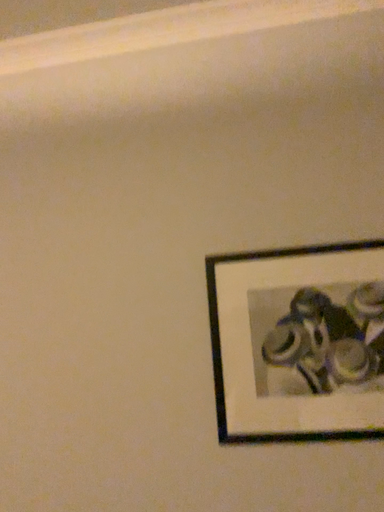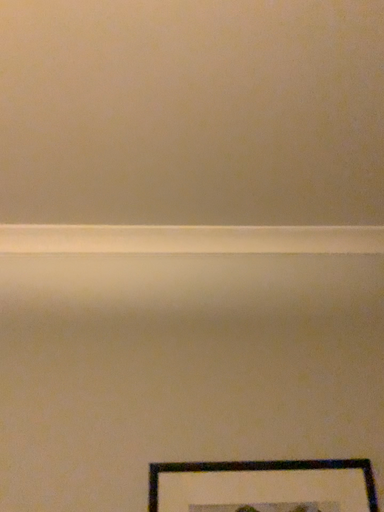
Question: How did the camera likely rotate when shooting the video?

Choices:
 (A) rotated right
 (B) rotated left

Answer: (A)